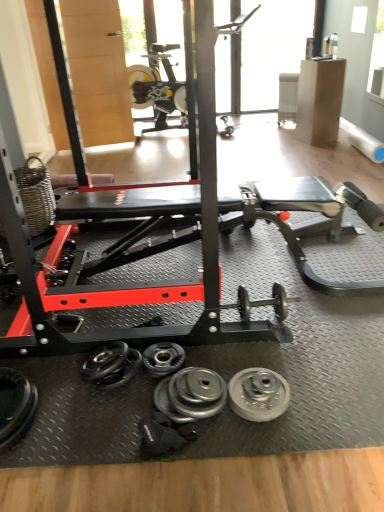
Where is `empty space that is ontop of silver metallic weight at center, marked as the second wheel in a right-to-left arrangement (from a real-world perspective)`? empty space that is ontop of silver metallic weight at center, marked as the second wheel in a right-to-left arrangement (from a real-world perspective) is located at coordinates (169, 402).